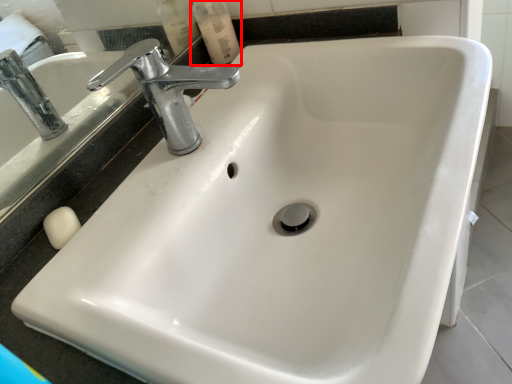
Question: From the image's perspective, what is the correct spatial relationship of mouthwash (annotated by the red box) in relation to tap?

Choices:
 (A) below
 (B) above

Answer: (B)